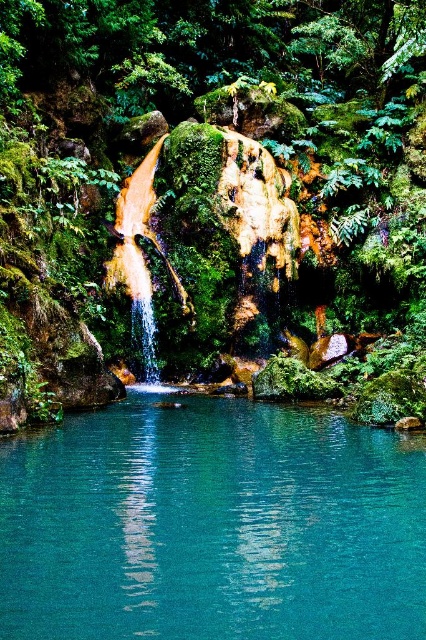
Is green mossy rock at center below teal glass pool at center?

No.

In the scene shown: Between green mossy rock at center and teal glass pool at center, which one is positioned lower?

teal glass pool at center is below.

Is point (203, 6) less distant than point (253, 426)?

That is False.

Find the location of a particular element. The image size is (426, 640). green mossy rock at center is located at coordinates (212, 172).